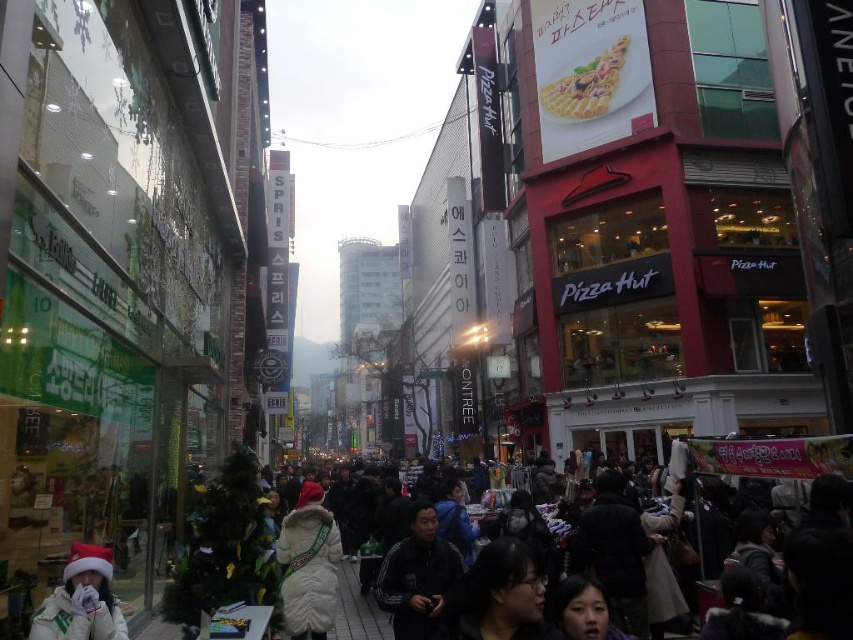
You are standing at the center of the street and see a point marked at coordinates (308, 564). Based on the scene description, what object is this point located on?

The point at coordinates (308, 564) is located on the white fur coat at center.

You are a delivery person standing at the edge of the street. You need to deliver a package to the person wearing the white fur coat at center. The dark gray jacket at center is blocking your path. Can you walk around them without getting too close? Explain your plan.

The distance between the white fur coat at center and dark gray jacket at center is 4.80 feet. Since the dark gray jacket at center is blocking the path, you can walk around them by moving either to the left or right side, maintaining a safe distance of at least 2.40 feet from each side. This ensures you can reach the person in the white fur coat at center without getting too close.